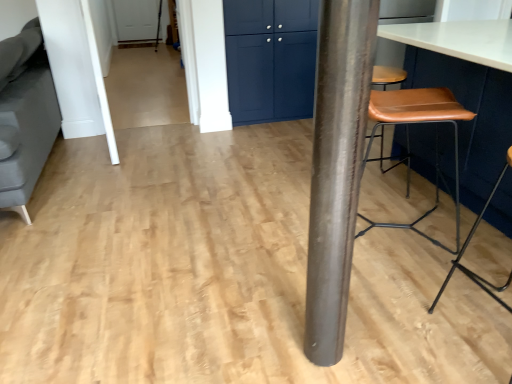
Question: Can you confirm if brown leather stool at right is positioned to the left of matte blue cabinet at upper center?

Choices:
 (A) no
 (B) yes

Answer: (A)

Question: Would you consider brown leather stool at right to be distant from matte blue cabinet at upper center?

Choices:
 (A) yes
 (B) no

Answer: (A)

Question: Can you confirm if brown leather stool at right is thinner than matte blue cabinet at upper center?

Choices:
 (A) yes
 (B) no

Answer: (B)

Question: Is matte blue cabinet at upper center located within brown leather stool at right?

Choices:
 (A) no
 (B) yes

Answer: (A)

Question: Does brown leather stool at right appear on the right side of matte blue cabinet at upper center?

Choices:
 (A) yes
 (B) no

Answer: (A)

Question: Is brown leather stool at right in contact with matte blue cabinet at upper center?

Choices:
 (A) yes
 (B) no

Answer: (B)

Question: From a real-world perspective, is matte blue cabinet at upper center below shiny metallic pole at center?

Choices:
 (A) no
 (B) yes

Answer: (B)

Question: Considering the relative sizes of matte blue cabinet at upper center and shiny metallic pole at center in the image provided, is matte blue cabinet at upper center wider than shiny metallic pole at center?

Choices:
 (A) no
 (B) yes

Answer: (A)

Question: Is matte blue cabinet at upper center facing away from shiny metallic pole at center?

Choices:
 (A) no
 (B) yes

Answer: (A)

Question: Does matte blue cabinet at upper center have a lesser height compared to shiny metallic pole at center?

Choices:
 (A) no
 (B) yes

Answer: (B)

Question: From the image's perspective, is matte blue cabinet at upper center over shiny metallic pole at center?

Choices:
 (A) no
 (B) yes

Answer: (B)

Question: From a real-world perspective, is matte blue cabinet at upper center positioned over shiny metallic pole at center based on gravity?

Choices:
 (A) no
 (B) yes

Answer: (A)

Question: Is brown leather stool at right looking in the opposite direction of matte blue cabinet at upper center?

Choices:
 (A) no
 (B) yes

Answer: (A)